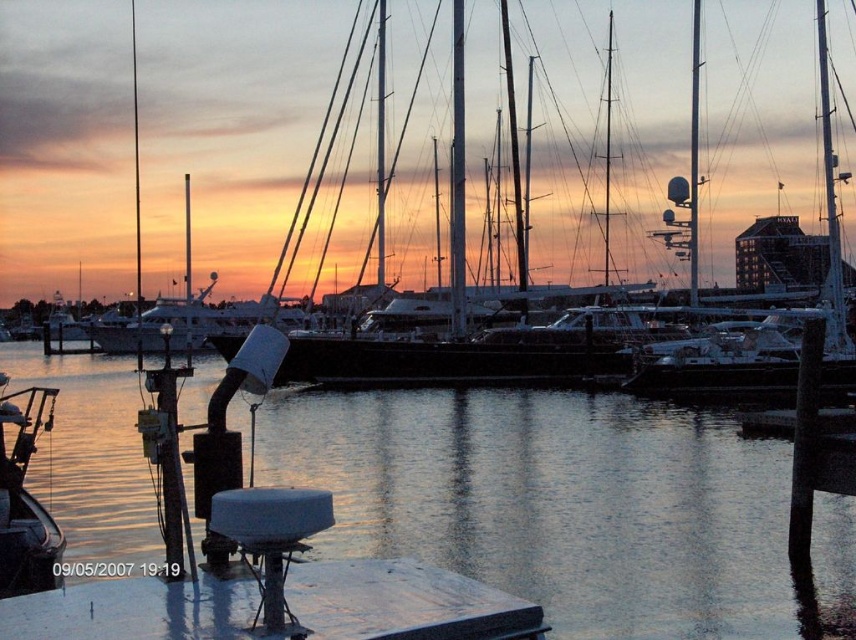
Question: Does shiny silver yacht at center have a larger size compared to white glossy mast at center?

Choices:
 (A) no
 (B) yes

Answer: (B)

Question: Among these points, which one is farthest from the camera?

Choices:
 (A) (690, 250)
 (B) (520, 422)
 (C) (459, 218)
 (D) (27, 531)

Answer: (A)

Question: Which point is closer to the camera taking this photo?

Choices:
 (A) click(691, 58)
 (B) click(193, 337)
 (C) click(48, 522)

Answer: (C)

Question: Observing the image, what is the correct spatial positioning of shiny silver yacht at center in reference to white glossy mast at center?

Choices:
 (A) above
 (B) below

Answer: (B)

Question: Which point appears closest to the camera in this image?

Choices:
 (A) (697, 56)
 (B) (167, 300)

Answer: (A)

Question: Is white glossy mast at center above metallic silver mast at upper right?

Choices:
 (A) yes
 (B) no

Answer: (B)